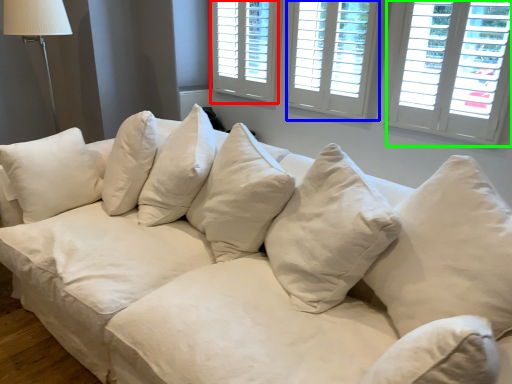
Question: Based on their relative distances, which object is farther from window (highlighted by a red box)? Choose from window (highlighted by a blue box) and window (highlighted by a green box).

Choices:
 (A) window
 (B) window

Answer: (B)